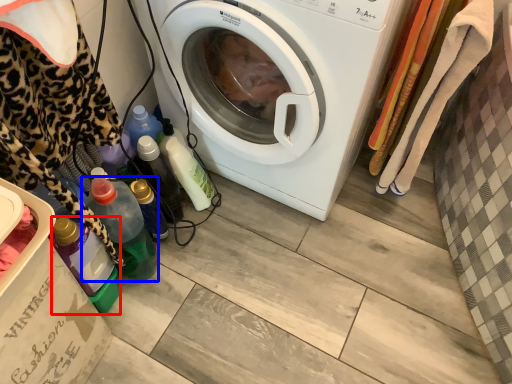
Question: Which object is closer to the camera taking this photo, bottle (highlighted by a red box) or bottle (highlighted by a blue box)?

Choices:
 (A) bottle
 (B) bottle

Answer: (A)